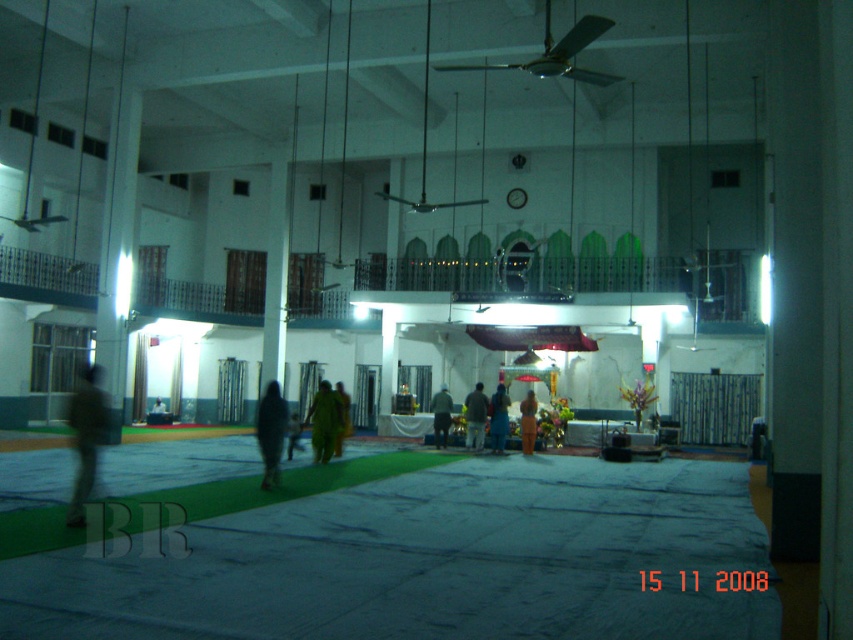
You are a visitor entering the mosque and need to place a small prayer mat. You see the orange fabric cloth at center and the brown fabric cloth at center. Which cloth can accommodate your mat if it is smaller than both?

The orange fabric cloth at center is larger in size than the brown fabric cloth at center, so the orange fabric cloth at center can accommodate your mat.

In the scene shown: You are standing in the mosque and want to determine the relative positions of two points marked in the image. Which point is closer to you, point (80, 500) or point (337, 438)?

Point (80, 500) is closer to the camera than point (337, 438).

You are planning to place a small table in the mosque. The table requires a space of at least 1.2 meters in width. You see the dark green fabric at left and the green fabric cloth at center. Which area would be suitable for placing the table?

The dark green fabric at left is bigger than the green fabric cloth at center, so the dark green fabric at left would be suitable for placing the table since it has enough space to accommodate the table.